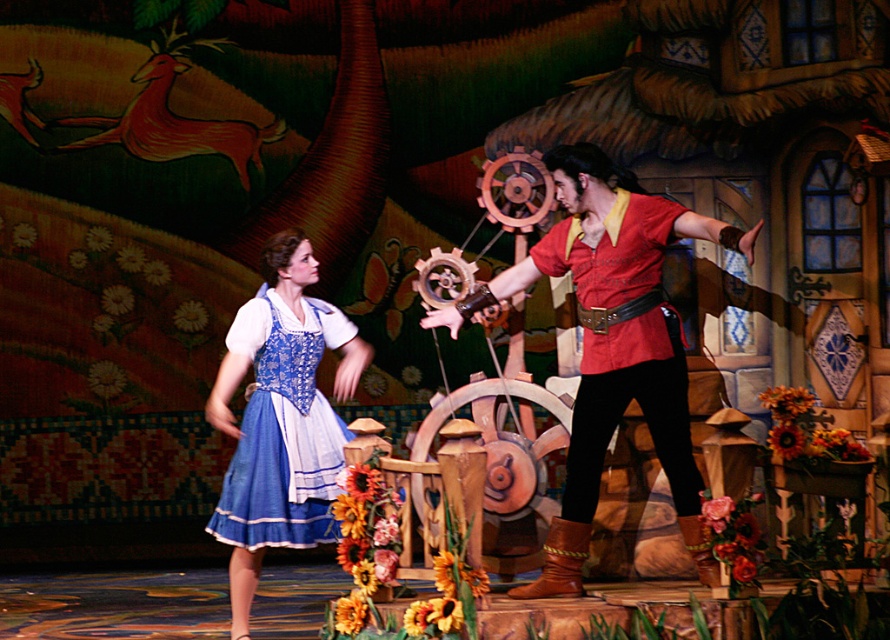
Question: Can you confirm if matte brown leather glove at center is thinner than blue satin dress at left?

Choices:
 (A) yes
 (B) no

Answer: (B)

Question: In this image, where is matte red shirt at center located relative to blue satin dress at left?

Choices:
 (A) right
 (B) left

Answer: (A)

Question: Which object appears closest to the camera in this image?

Choices:
 (A) blue satin dress at left
 (B) matte brown leather glove at center
 (C) matte red shirt at center

Answer: (B)

Question: Can you confirm if matte brown leather glove at center is positioned above blue satin dress at left?

Choices:
 (A) no
 (B) yes

Answer: (B)

Question: Which object is the farthest from the blue satin dress at left?

Choices:
 (A) matte red shirt at center
 (B) matte brown leather glove at center

Answer: (A)

Question: Which point is closer to the camera taking this photo?

Choices:
 (A) (630, 276)
 (B) (662, 308)

Answer: (A)